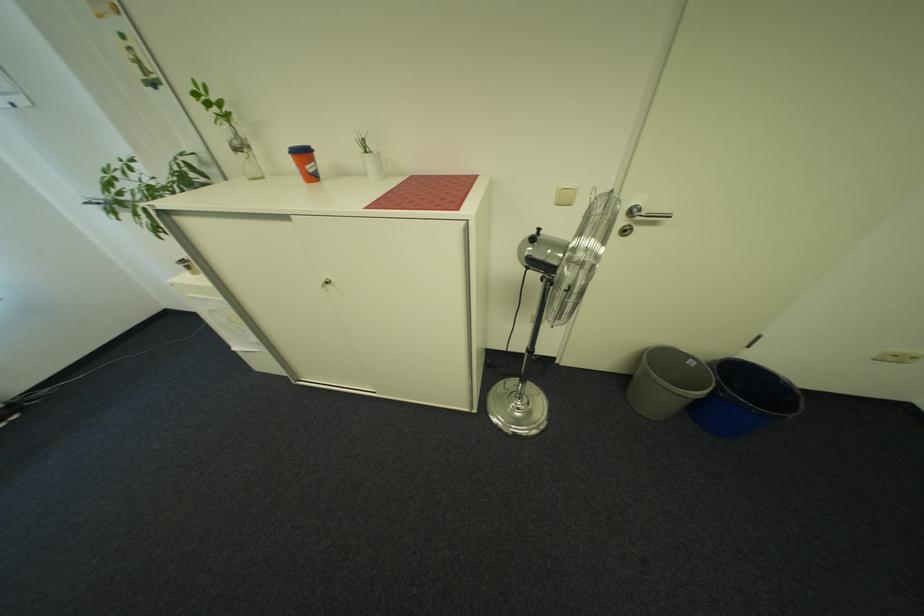
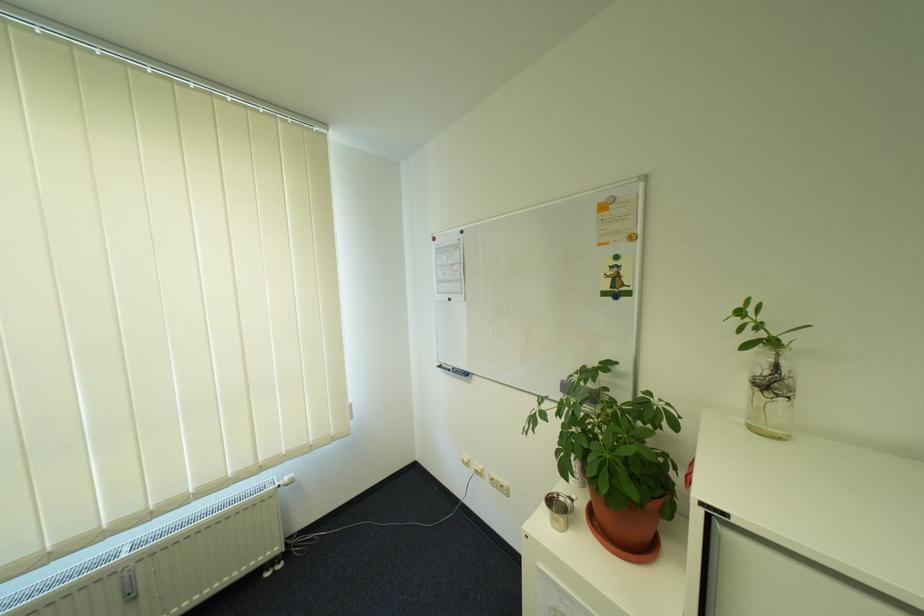
In the second image, find the point that corresponds to point 247,135 in the first image.

(785, 369)